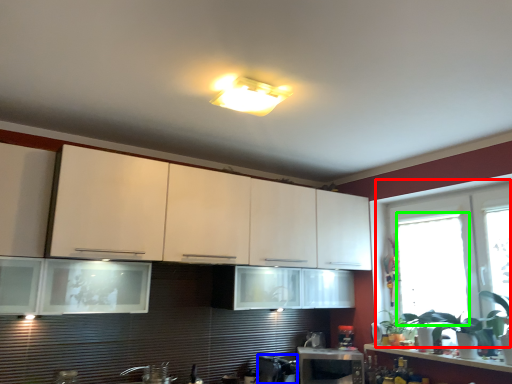
Question: Considering the real-world distances, which object is farthest from window (highlighted by a red box)? appliance (highlighted by a blue box) or window (highlighted by a green box)?

Choices:
 (A) appliance
 (B) window

Answer: (A)